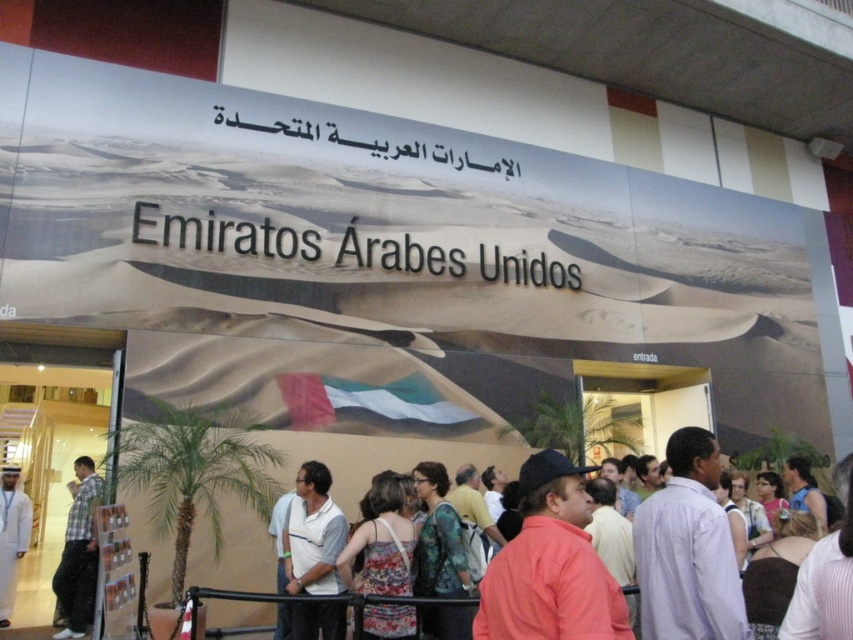
Question: In this image, where is white matte shirt at center located relative to white fabric at center?

Choices:
 (A) below
 (B) above

Answer: (B)

Question: Does black metallic sign at center appear on the right side of plaid cotton shirt at left?

Choices:
 (A) yes
 (B) no

Answer: (A)

Question: Does white matte shirt at center appear on the right side of white fabric at center?

Choices:
 (A) no
 (B) yes

Answer: (B)

Question: Which is nearer to the plaid cotton shirt at left?

Choices:
 (A) white matte shirt at center
 (B) white fabric at center

Answer: (B)

Question: Among these objects, which one is farthest from the camera?

Choices:
 (A) white matte shirt at center
 (B) plaid cotton shirt at left

Answer: (B)

Question: Which object is farther from the camera taking this photo?

Choices:
 (A) plaid cotton shirt at left
 (B) black metallic sign at center

Answer: (B)